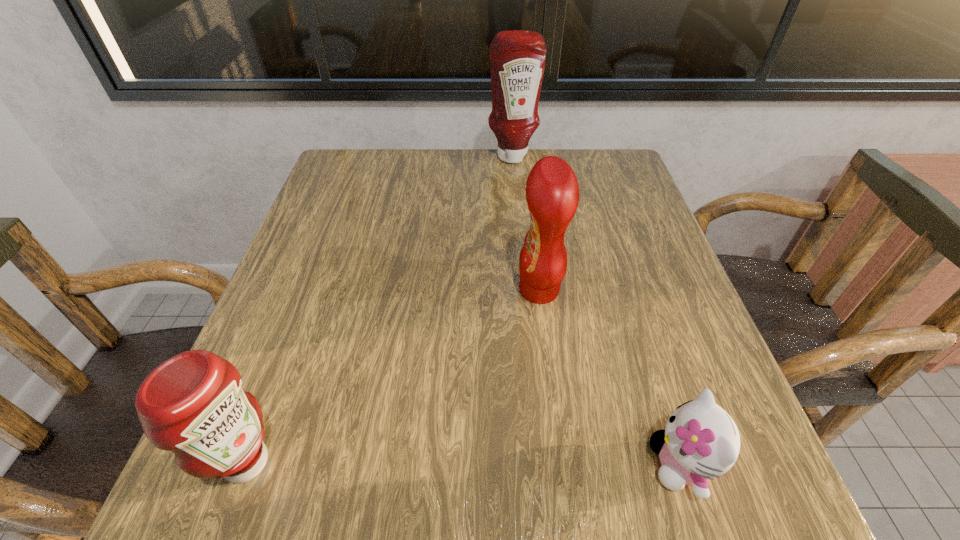
Locate an element on the screen. The width and height of the screenshot is (960, 540). free spot located 0.180m on the label side of the third nearest object is located at coordinates (420, 290).

You are a GUI agent. You are given a task and a screenshot of the screen. Output one action in this format:
    pyautogui.click(x=<x>, y=<y>)
    Task: Click on the blank space located 0.050m on the label side of the third nearest object
    The height and width of the screenshot is (540, 960).
    Given the screenshot: What is the action you would take?
    pyautogui.click(x=490, y=290)

Locate an element on the screen. The image size is (960, 540). vacant space situated on the right of the nearest condiment is located at coordinates (536, 462).

The height and width of the screenshot is (540, 960). In order to click on vacant space situated 0.240m on the front-facing side of the kitten in this screenshot , I will do `click(470, 464)`.

Image resolution: width=960 pixels, height=540 pixels. In order to click on vacant space located 0.360m on the front-facing side of the kitten in this screenshot , I will do `click(381, 464)`.

Where is `vacant region located on the front-facing side of the kitten`? vacant region located on the front-facing side of the kitten is located at coordinates (373, 464).

Find the location of a particular element. This screenshot has height=540, width=960. object located in the far edge section of the desktop is located at coordinates (517, 58).

In order to click on condiment that is at the near edge in this screenshot , I will do `click(193, 404)`.

Image resolution: width=960 pixels, height=540 pixels. Identify the location of kitten that is positioned at the near edge. (700, 440).

Where is `object that is at the left edge`? This screenshot has height=540, width=960. object that is at the left edge is located at coordinates (193, 404).